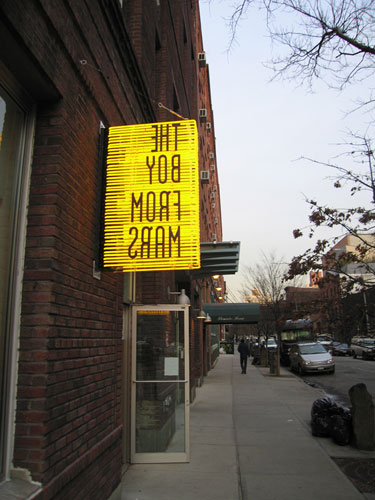
I want to click on covers, so click(239, 317), click(220, 258).